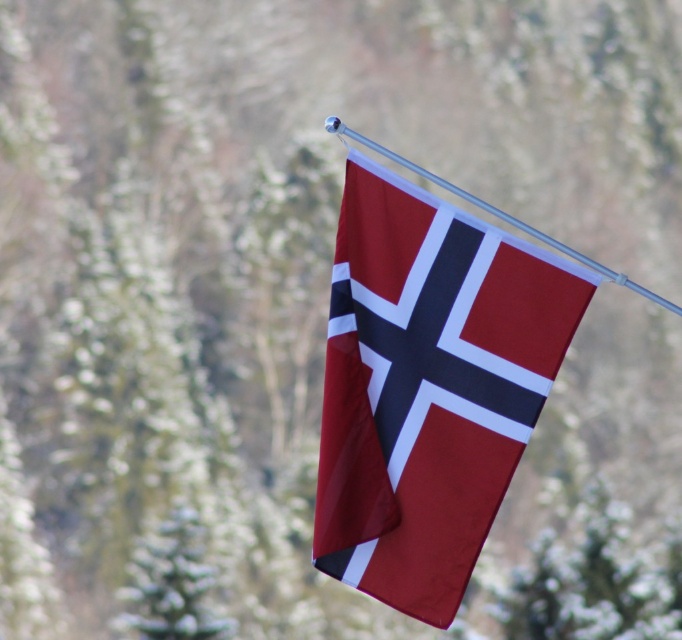
Between matte fabric flag at center and metallic silver flag pole at upper center, which one has less height?

metallic silver flag pole at upper center is shorter.

Who is positioned more to the left, matte fabric flag at center or metallic silver flag pole at upper center?

matte fabric flag at center is more to the left.

Who is more distant from viewer, (527, 316) or (413, 164)?

Positioned behind is point (527, 316).

Where is `matte fabric flag at center`? The width and height of the screenshot is (682, 640). matte fabric flag at center is located at coordinates (428, 387).